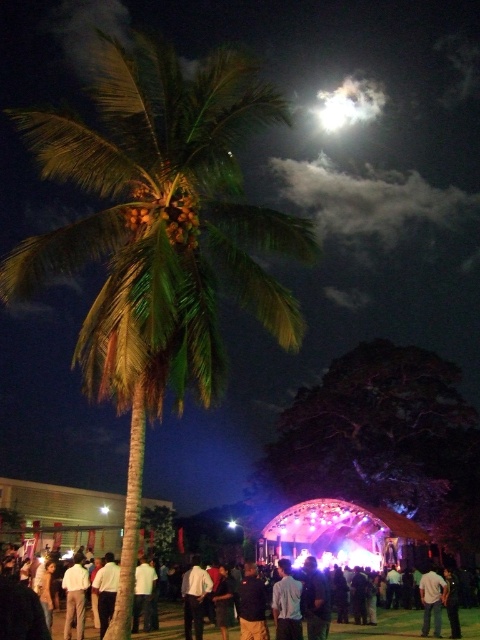
Question: Can you confirm if light blue shirt at center is smaller than white matte shirt at center?

Choices:
 (A) no
 (B) yes

Answer: (B)

Question: Which is farther from the white matte shirt at lower right?

Choices:
 (A) white matte shirt at center
 (B) light brown fabric shirt at lower left
 (C) dark fabric crowd at center
 (D) light blue shirt at center

Answer: (B)

Question: Which object is positioned closest to the light blue shirt at center?

Choices:
 (A) light brown fabric shirt at lower left
 (B) white matte shirt at center

Answer: (B)

Question: Is white matte shirt at center closer to camera compared to white matte shirt at lower right?

Choices:
 (A) no
 (B) yes

Answer: (B)

Question: Does white matte shirt at center appear on the left side of light brown fabric shirt at lower left?

Choices:
 (A) no
 (B) yes

Answer: (A)

Question: Based on their relative distances, which object is farther from the white matte shirt at center?

Choices:
 (A) white matte shirt at lower right
 (B) dark fabric crowd at center
 (C) light brown fabric shirt at lower left
 (D) light blue shirt at center

Answer: (A)